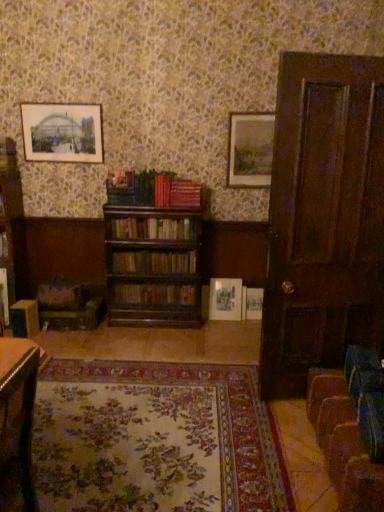
Question: Based on their sizes in the image, would you say matte white picture frame at center, marked as the 1th picture frame in a right-to-left arrangement, is bigger or smaller than matte gold picture frame at center, which is the third picture frame in right-to-left order?

Choices:
 (A) big
 (B) small

Answer: (B)

Question: Is matte white picture frame at center, placed as the 4th picture frame when sorted from top to bottom, in front of or behind matte gold picture frame at center, which is the third picture frame in right-to-left order, in the image?

Choices:
 (A) behind
 (B) front

Answer: (A)

Question: Considering the real-world distances, which object is farthest from the velvet brown swivel chair at lower right, acting as the first swivel chair starting from the front?

Choices:
 (A) wooden bookshelf at center, which is counted as the 3th book, starting from the top
 (B) wooden bookshelf at center, acting as the 4th book starting from the top
 (C) brown wooden bookcase at left
 (D) wooden table at lower left
 (E) matte white picture frame at center, marked as the 1th picture frame in a right-to-left arrangement

Answer: (C)

Question: Considering the real-world distances, which object is farthest from the wooden swivel chair at lower left, the first swivel chair viewed from the top?

Choices:
 (A) velvet brown swivel chair at lower right, acting as the first swivel chair starting from the front
 (B) brown wooden bookcase at left
 (C) matte gold picture frame at center, which ranks as the 2th picture frame in bottom-to-top order
 (D) wooden bookshelf at center, which is counted as the 2th book, starting from the bottom
 (E) matte white picture frame at center, which ranks as the 4th picture frame in left-to-right order

Answer: (A)